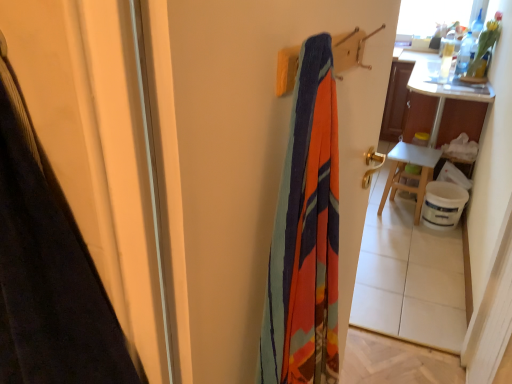
Question: Is textured fabric screen door at center spatially inside white wooden table at right, or outside of it?

Choices:
 (A) outside
 (B) inside

Answer: (A)

Question: Considering their positions, is textured fabric screen door at center located in front of or behind white wooden table at right?

Choices:
 (A) behind
 (B) front

Answer: (B)

Question: Which object is positioned closest to the white wooden table at right?

Choices:
 (A) white wooden table at right
 (B) textured fabric screen door at center

Answer: (A)

Question: Which object is the farthest from the textured fabric screen door at center?

Choices:
 (A) white wooden table at right
 (B) white wooden table at right

Answer: (B)